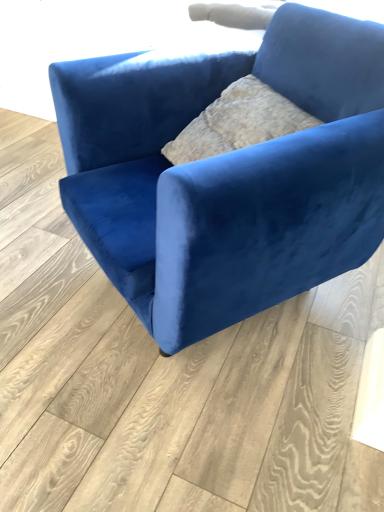
What is the approximate height of velvet blue armchair at center?

33.96 inches.

What do you see at coordinates (226, 174) in the screenshot? I see `velvet blue armchair at center` at bounding box center [226, 174].

I want to click on velvet blue armchair at center, so click(x=226, y=174).

What are the coordinates of `velvet blue armchair at center` in the screenshot? It's located at (226, 174).